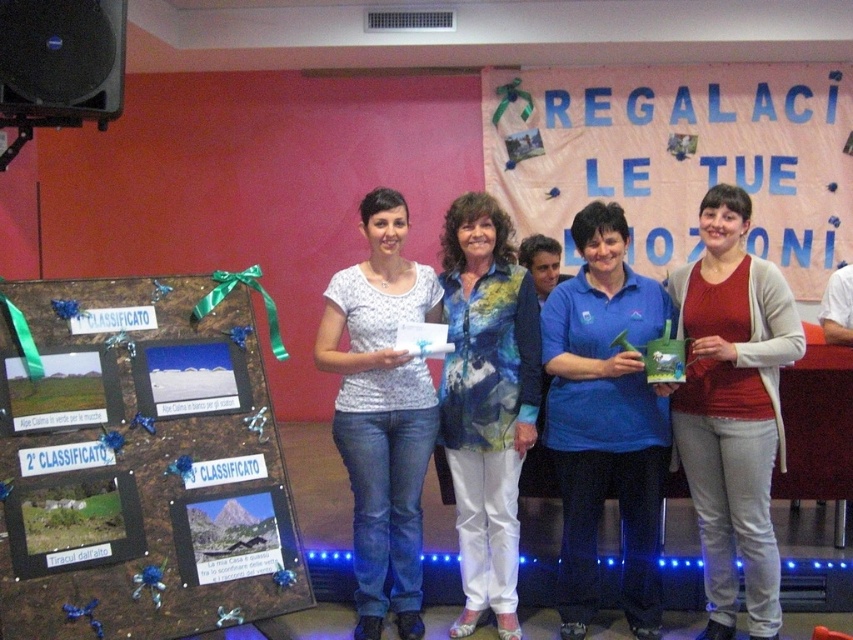
Question: Which object is closer to the camera taking this photo?

Choices:
 (A) matte red sweater at right
 (B) brown wooden board at left

Answer: (B)

Question: Does brown wooden board at left have a greater width compared to printed cotton blouse at center?

Choices:
 (A) yes
 (B) no

Answer: (A)

Question: Is brown wooden board at left thinner than printed cotton blouse at center?

Choices:
 (A) yes
 (B) no

Answer: (B)

Question: Which of the following is the closest to the observer?

Choices:
 (A) printed cotton blouse at center
 (B) white printed shirt at center

Answer: (B)

Question: Which object is the closest to the printed cotton blouse at center?

Choices:
 (A) matte red sweater at right
 (B) brown wooden board at left
 (C) white printed shirt at center
 (D) blue fabric shirt at center

Answer: (C)

Question: Can you confirm if brown wooden board at left is positioned below blue fabric shirt at center?

Choices:
 (A) yes
 (B) no

Answer: (A)